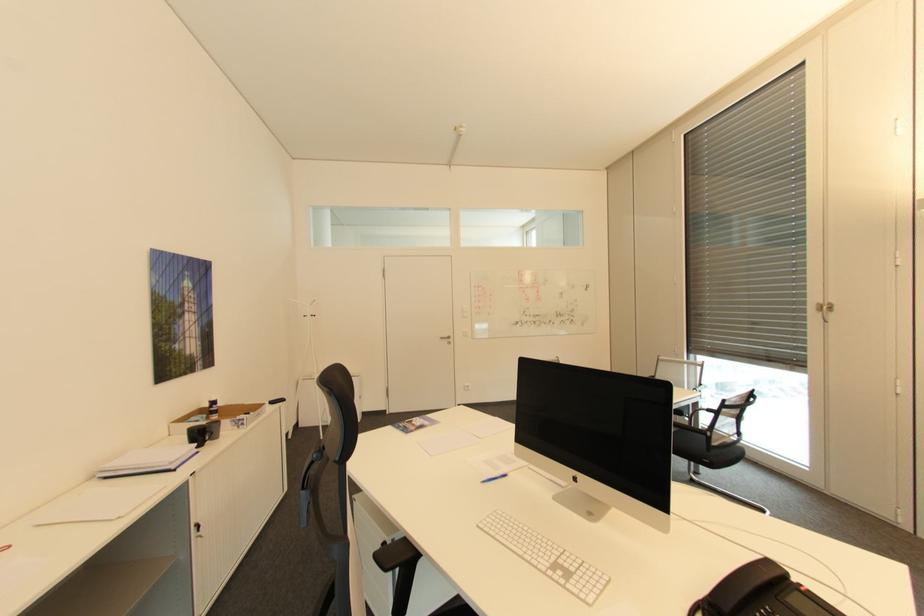
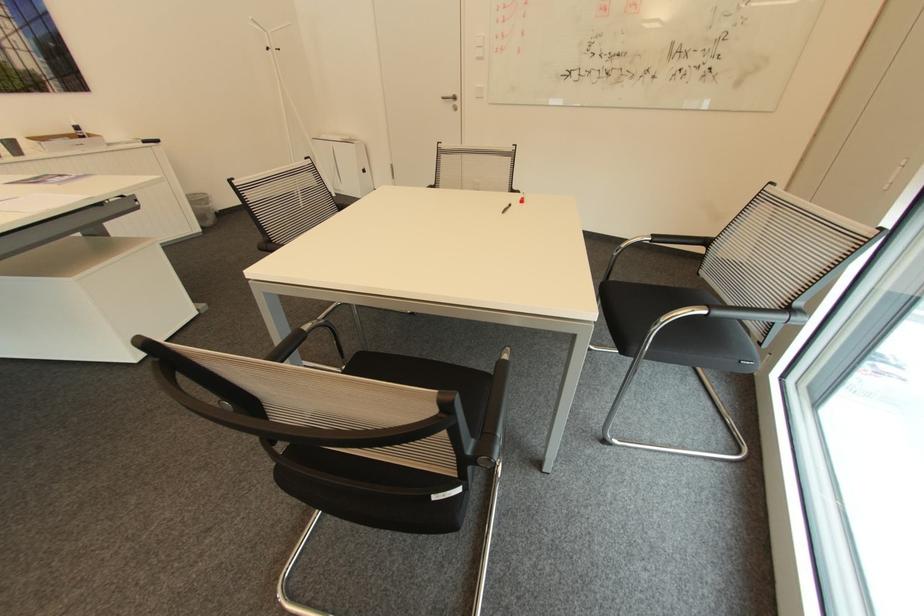
In the second image, find the point that corresponds to (x=451, y=334) in the first image.

(456, 95)